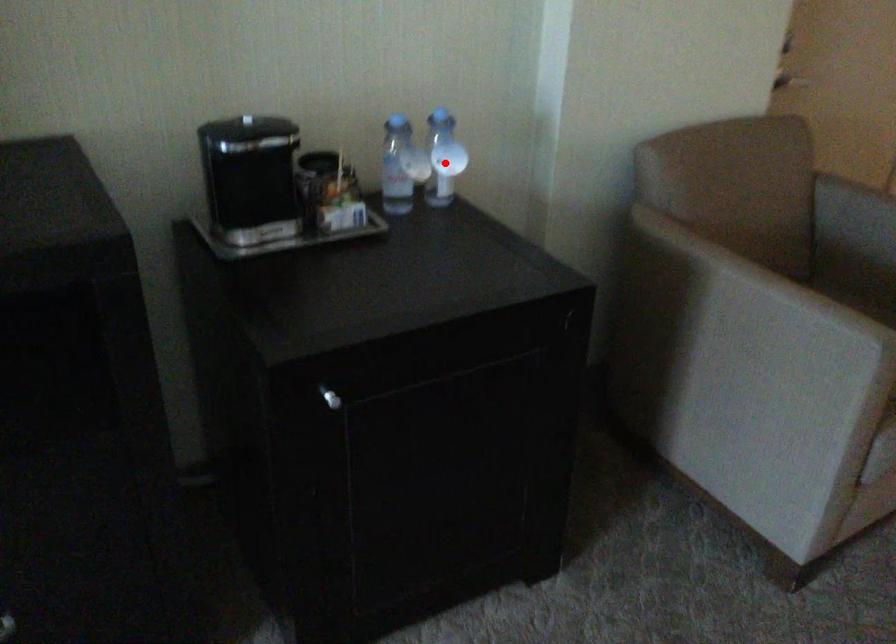
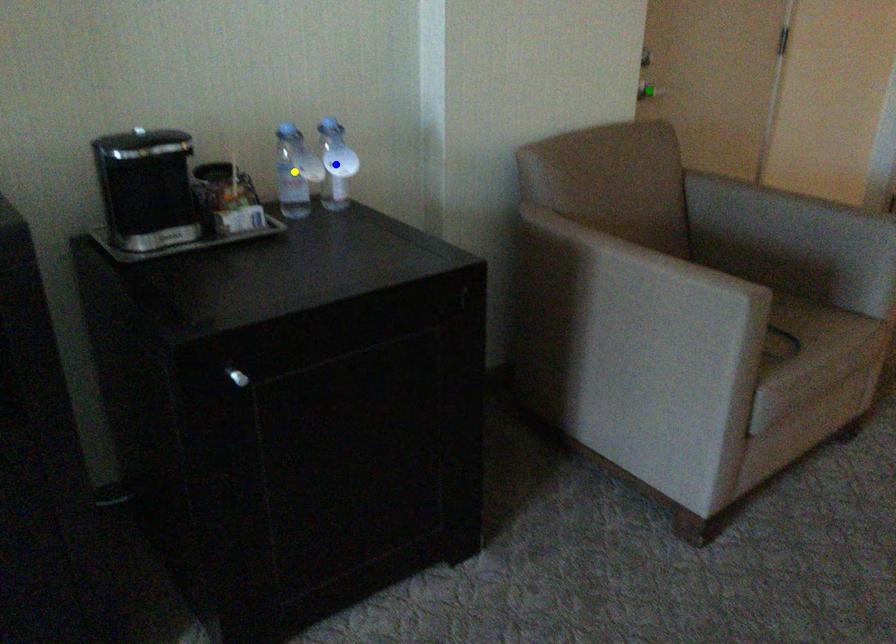
Question: I am providing you with two images of the same scene from different viewpoints. A red point is marked on the first image. You are given multiple points on the second image. In image 2, which mark is for the same physical point as the one in image 1?

Choices:
 (A) yellow point
 (B) blue point
 (C) green point

Answer: (B)